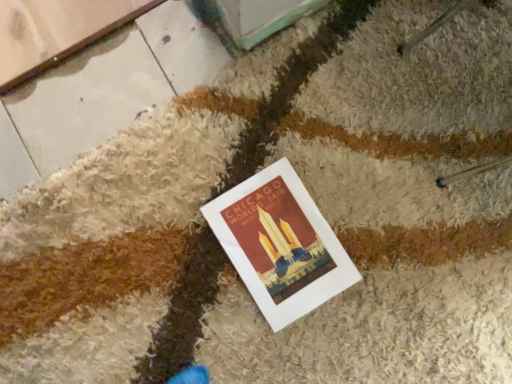
Describe the element at coordinates (280, 244) in the screenshot. The height and width of the screenshot is (384, 512). I see `matte paper poster at center` at that location.

Locate an element on the screen. This screenshot has width=512, height=384. matte paper poster at center is located at coordinates (280, 244).

Measure the distance between point (229, 203) and camera.

Point (229, 203) and camera are 34.53 inches apart from each other.

Image resolution: width=512 pixels, height=384 pixels. What are the coordinates of `matte paper poster at center` in the screenshot? It's located at (280, 244).